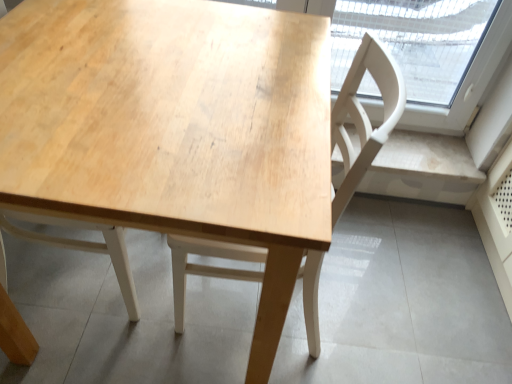
What is the approximate width of natural wood table at center?

natural wood table at center is 77.96 centimeters wide.

What do you see at coordinates (174, 128) in the screenshot?
I see `natural wood table at center` at bounding box center [174, 128].

The width and height of the screenshot is (512, 384). What are the coordinates of `natural wood table at center` in the screenshot? It's located at (174, 128).

What is the approximate height of light wood chair at center?

The height of light wood chair at center is 31.61 inches.

Find the location of a particular element. The width and height of the screenshot is (512, 384). light wood chair at center is located at coordinates (x=364, y=116).

What do you see at coordinates (364, 116) in the screenshot? I see `light wood chair at center` at bounding box center [364, 116].

I want to click on natural wood table at center, so (x=174, y=128).

Which is more to the right, light wood chair at center or natural wood table at center?

From the viewer's perspective, light wood chair at center appears more on the right side.

Is light wood chair at center in front of or behind natural wood table at center in the image?

Clearly, light wood chair at center is behind natural wood table at center.

Between point (310, 322) and point (122, 198), which one is positioned in front?

The point (122, 198) is more forward.

From the image's perspective, does light wood chair at center appear higher than natural wood table at center?

No, from the image's perspective, light wood chair at center is not above natural wood table at center.

From a real-world perspective, is light wood chair at center on natural wood table at center?

Yes, from a real-world perspective, light wood chair at center is on top of natural wood table at center.

Is light wood chair at center thinner than natural wood table at center?

Indeed, light wood chair at center has a lesser width compared to natural wood table at center.

Who is shorter, light wood chair at center or natural wood table at center?

natural wood table at center is shorter.

Considering the relative sizes of light wood chair at center and natural wood table at center in the image provided, is light wood chair at center smaller than natural wood table at center?

Correct, light wood chair at center occupies less space than natural wood table at center.

Would you say light wood chair at center is outside natural wood table at center?

No, light wood chair at center is inside natural wood table at center's boundary.

Is light wood chair at center not near natural wood table at center?

Actually, light wood chair at center and natural wood table at center are a little close together.

Consider the image. Is light wood chair at center facing towards natural wood table at center?

Yes, light wood chair at center faces towards natural wood table at center.

Locate an element on the screen. table that appears below the light wood chair at center (from a real-world perspective) is located at coordinates (174, 128).

Consider the image. Considering the positions of objects natural wood table at center and light wood chair at center in the image provided, who is more to the left, natural wood table at center or light wood chair at center?

From the viewer's perspective, natural wood table at center appears more on the left side.

In the image, is natural wood table at center positioned in front of or behind light wood chair at center?

natural wood table at center is in front of light wood chair at center.

Considering the positions of points (133, 188) and (396, 101), is point (133, 188) closer to camera compared to point (396, 101)?

That is True.

From the image's perspective, between natural wood table at center and light wood chair at center, who is located below?

light wood chair at center appears lower in the image.

From a real-world perspective, is natural wood table at center positioned over light wood chair at center based on gravity?

Incorrect, from a real-world perspective, natural wood table at center is lower than light wood chair at center.

Based on the photo, can you confirm if natural wood table at center is wider than light wood chair at center?

Correct, the width of natural wood table at center exceeds that of light wood chair at center.

Is natural wood table at center shorter than light wood chair at center?

Yes.

Can you confirm if natural wood table at center is smaller than light wood chair at center?

Actually, natural wood table at center might be larger than light wood chair at center.

Is natural wood table at center surrounding light wood chair at center?

Yes, light wood chair at center is inside natural wood table at center.

Are natural wood table at center and light wood chair at center far apart?

No, natural wood table at center is in close proximity to light wood chair at center.

Is natural wood table at center looking in the opposite direction of light wood chair at center?

natural wood table at center is not turned away from light wood chair at center.

Identify the location of table located underneath the light wood chair at center (from a real-world perspective). The image size is (512, 384). (174, 128).

Locate an element on the screen. The width and height of the screenshot is (512, 384). chair behind the natural wood table at center is located at coordinates (364, 116).

Locate an element on the screen. The image size is (512, 384). chair on the right of natural wood table at center is located at coordinates (364, 116).